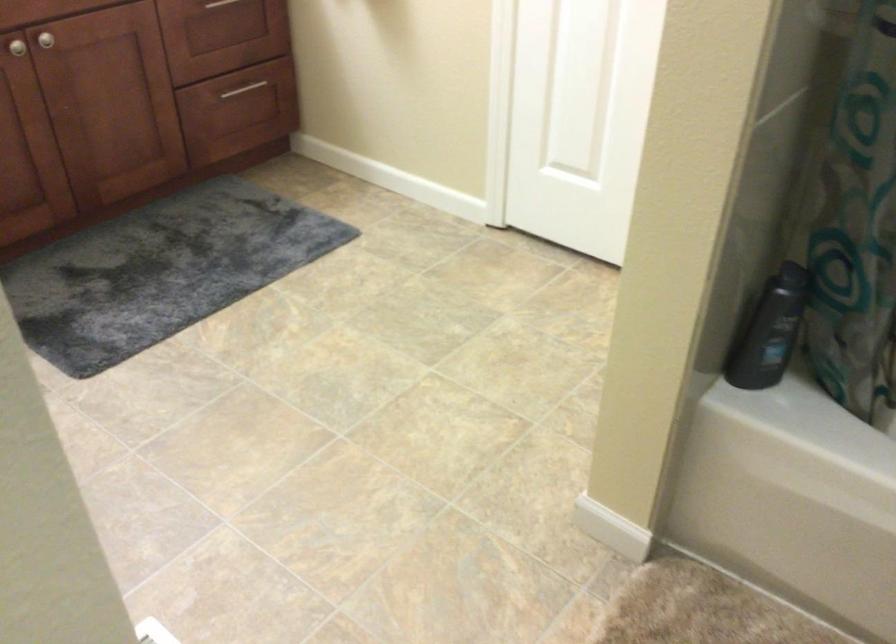
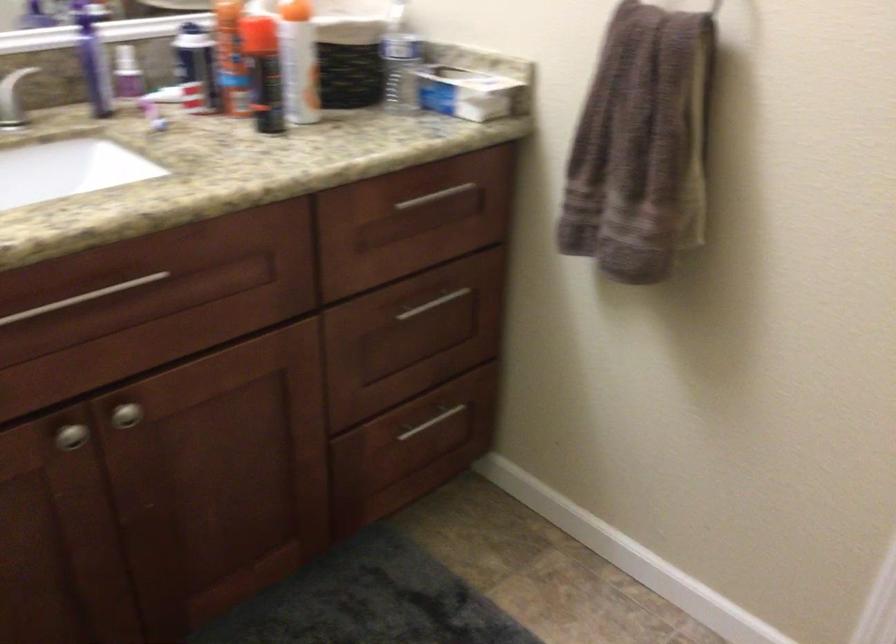
In the second image, find the point that corresponds to the point at 254,91 in the first image.

(432, 422)